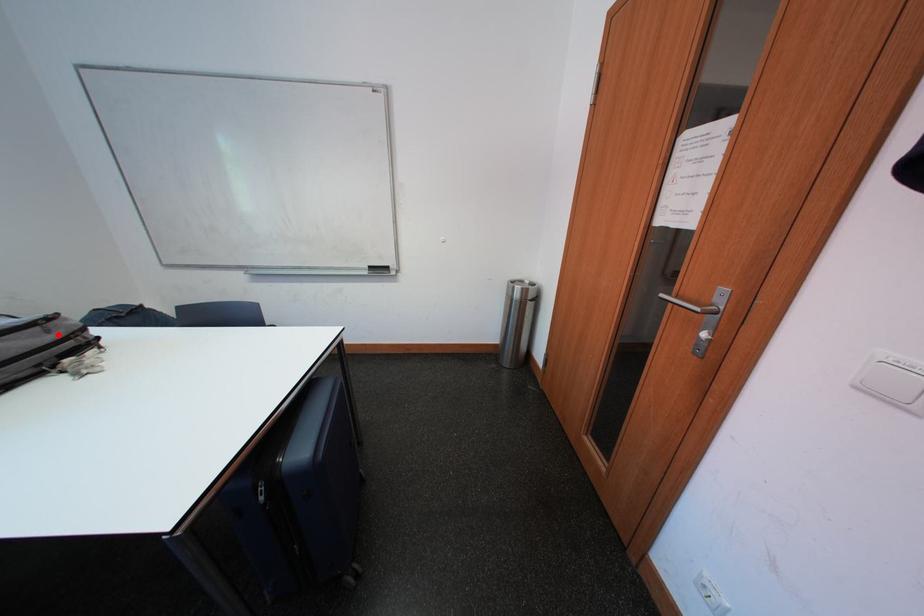
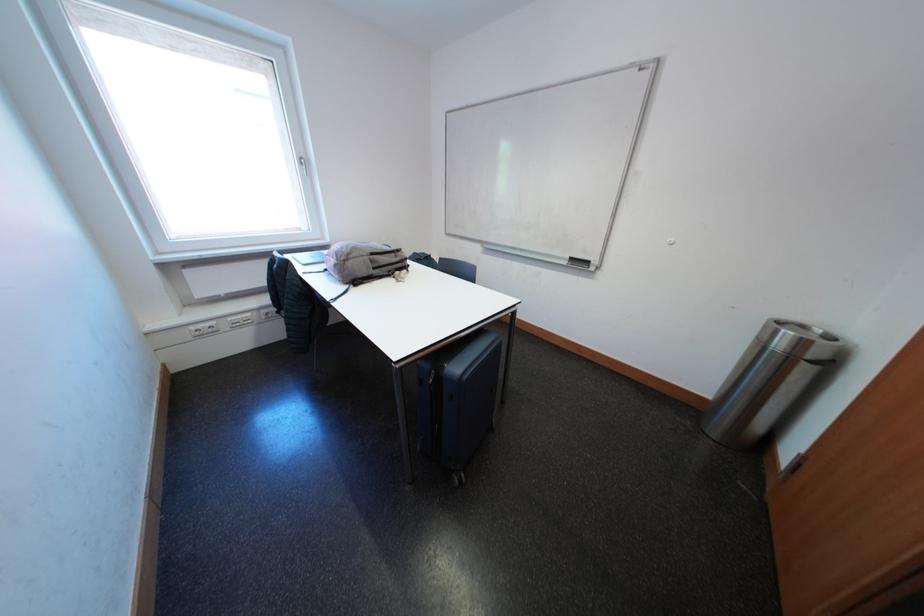
Locate, in the second image, the point that corresponds to the highlighted location in the first image.

(406, 261)